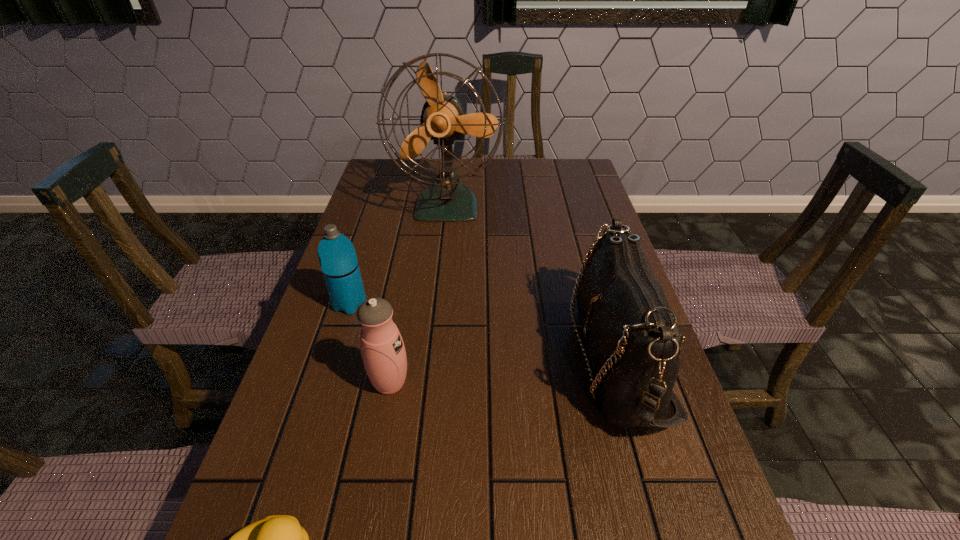
You are a GUI agent. You are given a task and a screenshot of the screen. Output one action in this format:
    pyautogui.click(x=<x>, y=<y>)
    Task: Click on the tallest object
    
    Given the screenshot: What is the action you would take?
    pyautogui.click(x=442, y=120)

This screenshot has width=960, height=540. What are the coordinates of `the farthest object` in the screenshot? It's located at (442, 120).

At what (x,y) coordinates should I click in order to perform the action: click on handbag. Please return your answer as a coordinate pair (x, y). This screenshot has width=960, height=540. Looking at the image, I should click on (632, 335).

This screenshot has height=540, width=960. In order to click on the right thermos bottle in this screenshot , I will do coord(382,348).

Locate an element on the screen. This screenshot has width=960, height=540. the farther thermos bottle is located at coordinates (339, 264).

Locate an element on the screen. This screenshot has width=960, height=540. vacant area situated on the front-facing side of the fan for air flow is located at coordinates (442, 262).

Locate an element on the screen. The image size is (960, 540). vacant space located at the front of the rightmost object with chain and zipper is located at coordinates click(499, 357).

Locate an element on the screen. Image resolution: width=960 pixels, height=540 pixels. free location located at the front of the rightmost object with chain and zipper is located at coordinates (453, 357).

The height and width of the screenshot is (540, 960). I want to click on vacant space situated 0.230m at the front of the rightmost object with chain and zipper, so click(x=467, y=357).

The width and height of the screenshot is (960, 540). In order to click on free point located 0.140m on the left of the right thermos bottle in this screenshot , I will do `click(300, 383)`.